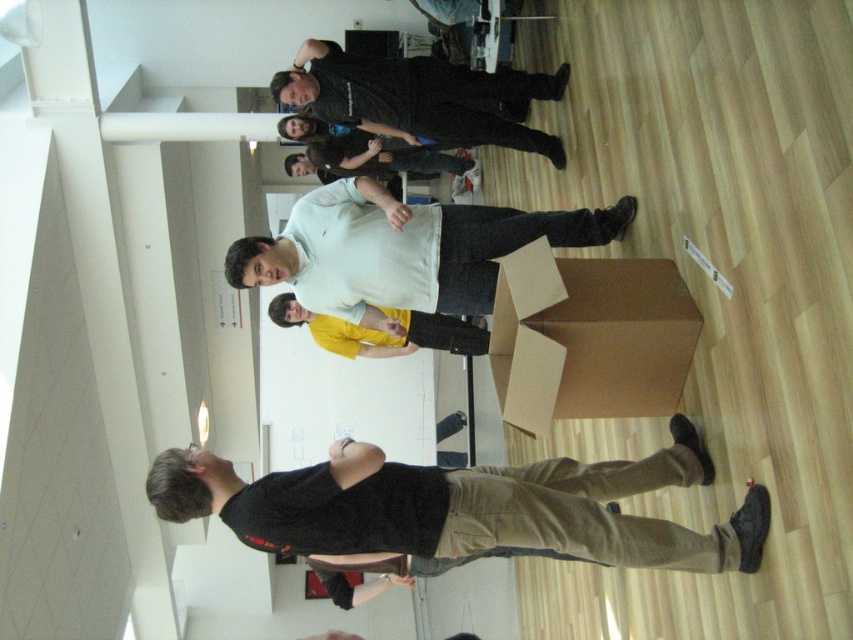
Question: Which object is farther from the camera taking this photo?

Choices:
 (A) brown cardboard box at lower center
 (B) yellow matte shirt at center

Answer: (B)

Question: Where is white matte shirt at center located in relation to dark blue shirt at center in the image?

Choices:
 (A) left
 (B) right

Answer: (B)

Question: Is dark gray shirt at center behind dark blue shirt at center?

Choices:
 (A) no
 (B) yes

Answer: (A)

Question: Can you confirm if dark gray shirt at center is bigger than yellow matte shirt at center?

Choices:
 (A) no
 (B) yes

Answer: (B)

Question: Considering the real-world distances, which object is closest to the white matte shirt at center?

Choices:
 (A) yellow matte shirt at center
 (B) black cotton shirt at lower left
 (C) dark blue shirt at center
 (D) dark gray shirt at center

Answer: (D)

Question: Which of the following is the closest to the observer?

Choices:
 (A) dark gray shirt at center
 (B) dark blue shirt at center
 (C) yellow matte shirt at center

Answer: (A)